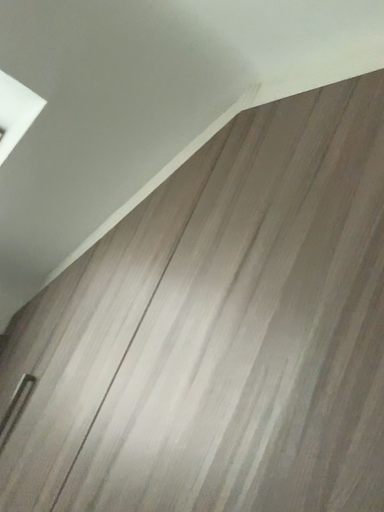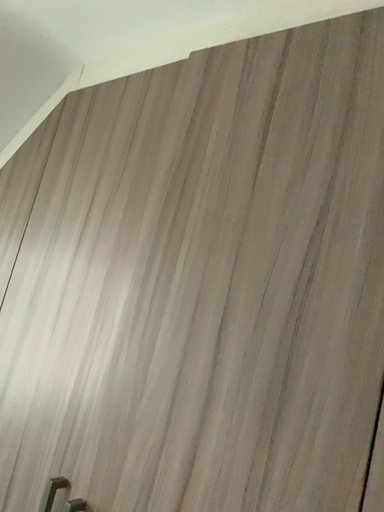
Question: Which way did the camera rotate in the video?

Choices:
 (A) rotated left
 (B) rotated right

Answer: (B)